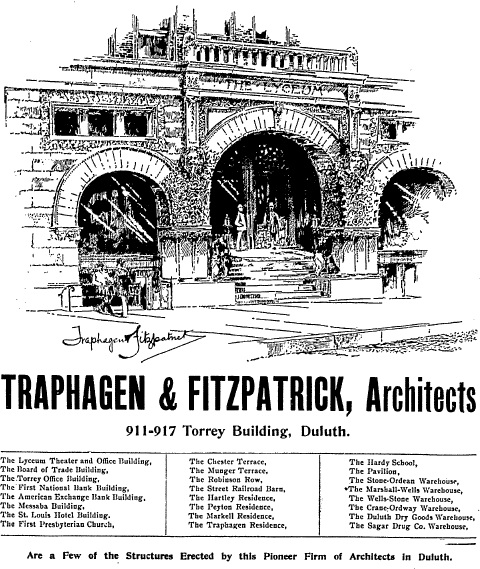
This screenshot has height=569, width=480. Identify the location of archway. (x=279, y=131).